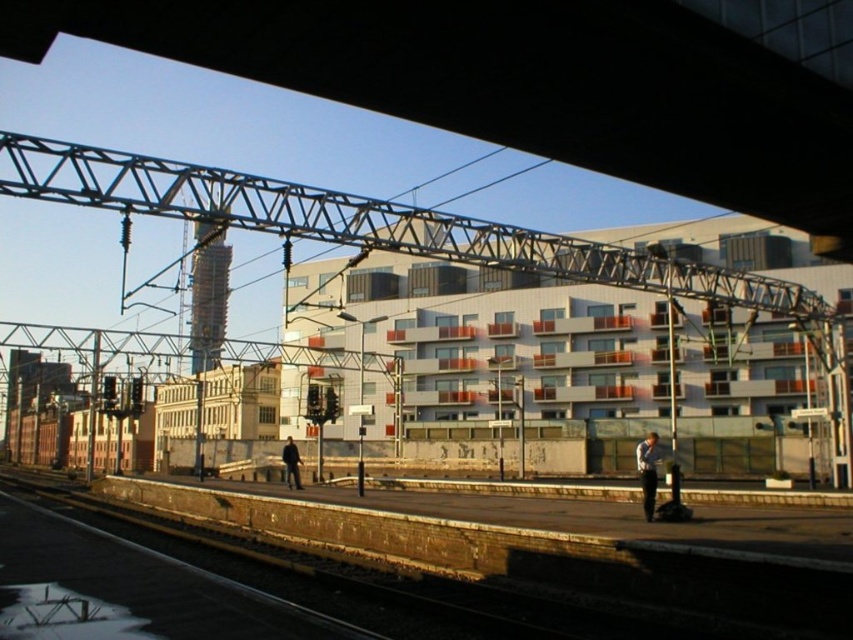
You are a photographer standing on the train station platform. You see a person wearing a light blue shirt at lower right and dark blue jeans at center. Which clothing item is higher in the scene?

The light blue shirt at lower right is located above the dark blue jeans at center in the scene.

You are a photographer standing on the train station platform. You want to take a photo of the light blue shirt at lower right and the dark blue jeans at center. Which object should you zoom in more on to ensure both appear clearly in the photo?

You should zoom in more on the dark blue jeans at center because the light blue shirt at lower right is larger in size, so zooming more on the smaller dark blue jeans at center will help both appear clearly in the photo.

You are standing on the train station platform and want to determine the relative positions of two points marked on the platform. The first point is at coordinates point (654, 492) and the second point is at point (294, 486). Which point is closer to you?

Point (654, 492) is closer to the viewer than point (294, 486).